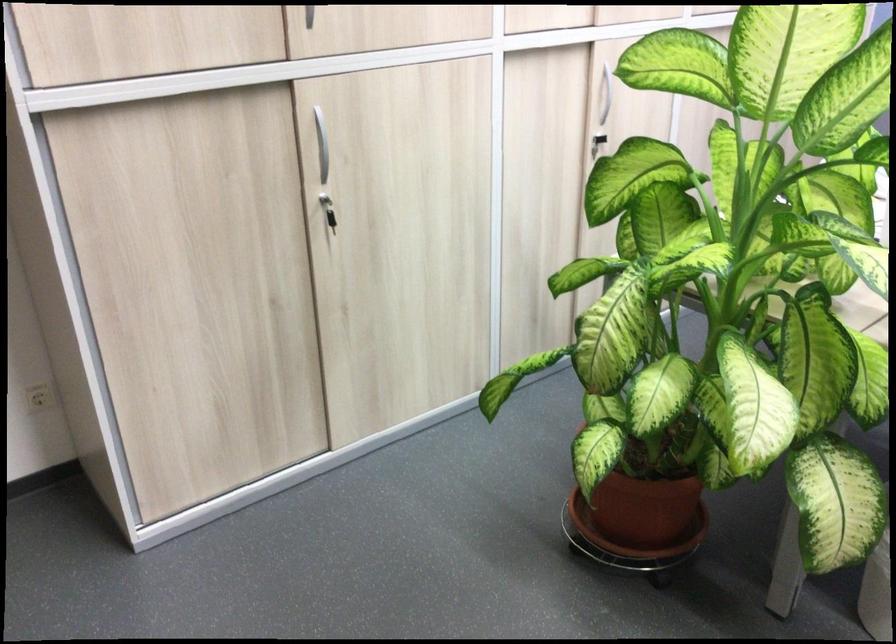
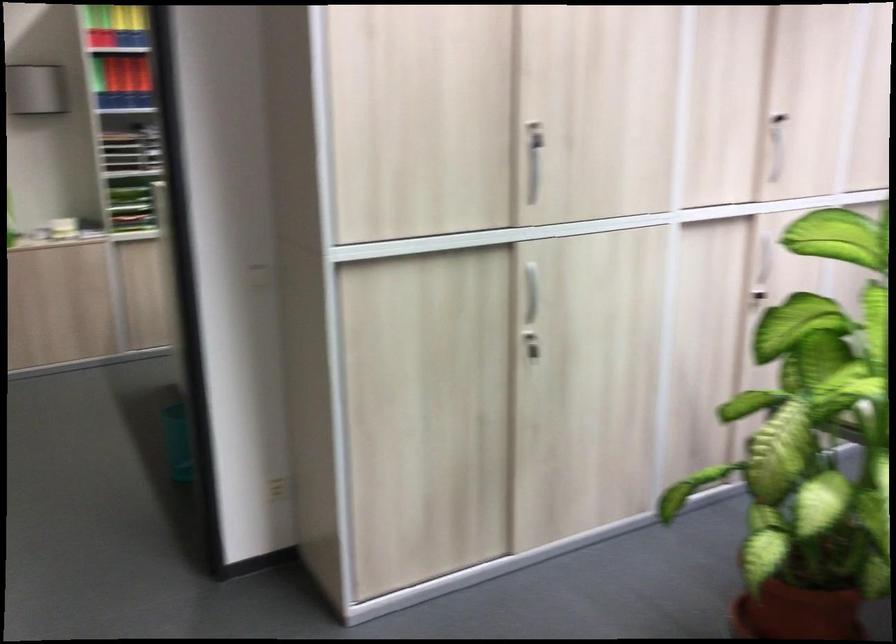
Question: I am providing you with two images of the same scene from different viewpoints. After the viewpoint changes to image2, which objects are now occluded?

Choices:
 (A) silver cabinet handle
 (B) cabinet door keyhole
 (C) terracotta plant pot
 (D) none of these

Answer: (D)